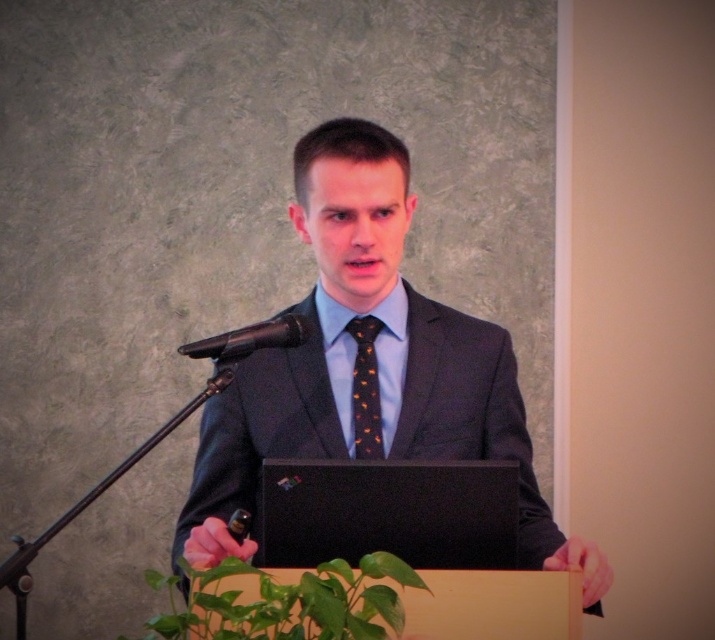
You are an event organizer setting up the stage for a presentation. The speaker will wear a matte black suit at center and use a black metallic microphone at center. Where should you place the microphone stand so that the microphone is positioned above the speaker?

The matte black suit at center is below the black metallic microphone at center, so the microphone stand should be placed so that the microphone is positioned above the speaker.

You are a photographer at the back of the room. You need to take a photo of both the matte black suit at center and the black metallic microphone at center. Which object will appear taller in the photo?

The matte black suit at center will appear taller in the photo because it is much taller than the black metallic microphone at center.